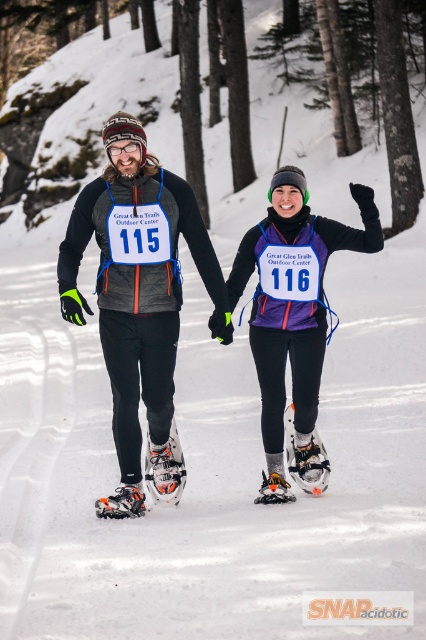
Can you confirm if white plastic snowshoe at lower left is positioned above orange plastic snowshoe at lower center?

Actually, white plastic snowshoe at lower left is below orange plastic snowshoe at lower center.

From the picture: How distant is white plastic snowshoe at lower left from orange plastic snowshoe at lower center?

They are 1.11 meters apart.

Is point (95, 509) in front of point (287, 497)?

Yes, it is.

Identify the location of white plastic snowshoe at lower left. [x=121, y=502].

Does matte black snowshoes at center have a lesser width compared to white mesh snowshoe at lower center?

No, matte black snowshoes at center is not thinner than white mesh snowshoe at lower center.

Is matte black snowshoes at center shorter than white mesh snowshoe at lower center?

No, matte black snowshoes at center is not shorter than white mesh snowshoe at lower center.

Does point (129, 256) come closer to viewer compared to point (164, 458)?

Yes, it is in front of point (164, 458).

This screenshot has height=640, width=426. Identify the location of matte black snowshoes at center. (293, 298).

Who is more distant from viewer, (299, 216) or (178, 497)?

The point (178, 497) is more distant.

Can you confirm if purple matte snowshoe at center is taller than white mesh snowshoe at lower center?

Yes.

Is point (316, 452) positioned behind point (184, 481)?

Yes.

Image resolution: width=426 pixels, height=640 pixels. I want to click on purple matte snowshoe at center, so click(293, 308).